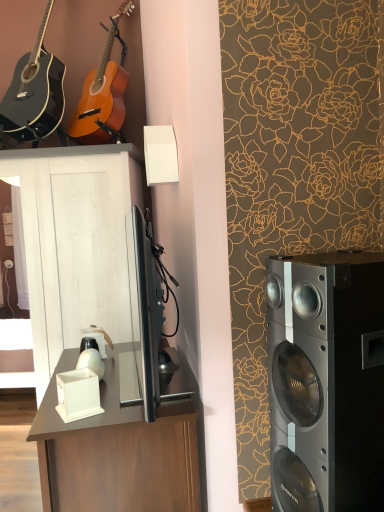
Question: Is silver metallic speaker at right further to camera compared to matte brown desk at center?

Choices:
 (A) no
 (B) yes

Answer: (A)

Question: Can you confirm if silver metallic speaker at right is wider than matte brown desk at center?

Choices:
 (A) no
 (B) yes

Answer: (A)

Question: From a real-world perspective, does silver metallic speaker at right stand above matte brown desk at center?

Choices:
 (A) yes
 (B) no

Answer: (A)

Question: From the image's perspective, is silver metallic speaker at right under matte brown desk at center?

Choices:
 (A) no
 (B) yes

Answer: (A)

Question: Is silver metallic speaker at right positioned with its back to matte brown desk at center?

Choices:
 (A) no
 (B) yes

Answer: (A)

Question: Is silver metallic speaker at right positioned before matte brown desk at center?

Choices:
 (A) no
 (B) yes

Answer: (B)

Question: Is matte brown desk at center facing away from orange wood guitar at upper left, the 1th guitar viewed from the right?

Choices:
 (A) no
 (B) yes

Answer: (A)

Question: Is matte brown desk at center positioned far away from orange wood guitar at upper left, the 1th guitar viewed from the right?

Choices:
 (A) yes
 (B) no

Answer: (A)

Question: Does matte brown desk at center have a greater width compared to orange wood guitar at upper left, the 1th guitar viewed from the right?

Choices:
 (A) no
 (B) yes

Answer: (B)

Question: Considering the relative sizes of matte brown desk at center and orange wood guitar at upper left, the 1th guitar viewed from the right, in the image provided, is matte brown desk at center shorter than orange wood guitar at upper left, the 1th guitar viewed from the right,?

Choices:
 (A) yes
 (B) no

Answer: (A)

Question: Is matte brown desk at center beside orange wood guitar at upper left, which appears as the second guitar when viewed from the left?

Choices:
 (A) no
 (B) yes

Answer: (A)

Question: Is matte brown desk at center to the left of orange wood guitar at upper left, the 1th guitar viewed from the right, from the viewer's perspective?

Choices:
 (A) no
 (B) yes

Answer: (A)

Question: Is white wood cabinet at center completely or partially outside of silver metallic speaker at right?

Choices:
 (A) no
 (B) yes

Answer: (B)